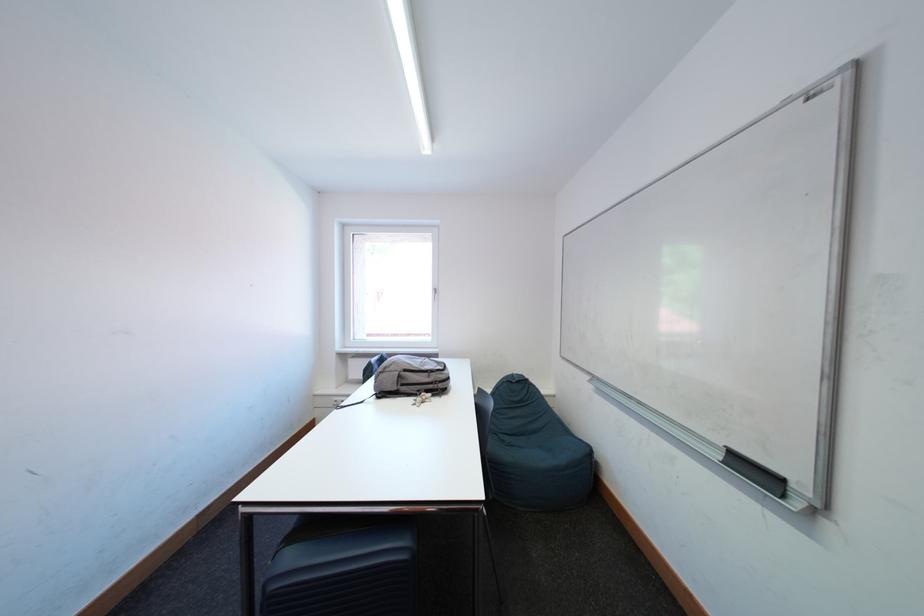
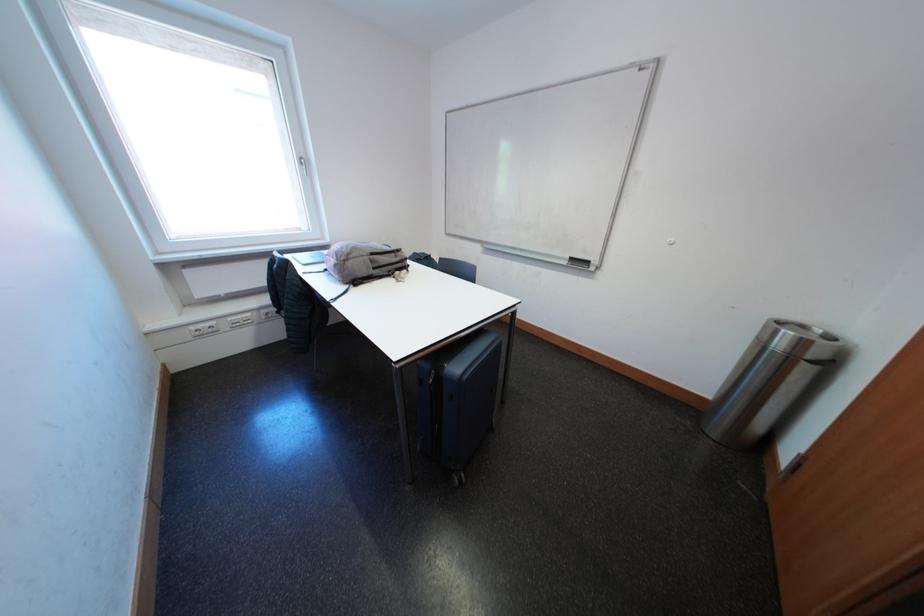
Find the pixel in the second image that matches point 345,402 in the first image.

(202, 331)